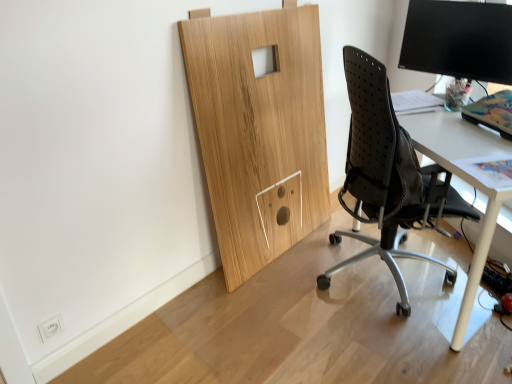
Question: Is white glossy desk at right at the left side of black mesh chair at right?

Choices:
 (A) no
 (B) yes

Answer: (A)

Question: Considering the relative positions of white glossy desk at right and black mesh chair at right in the image provided, is white glossy desk at right in front of black mesh chair at right?

Choices:
 (A) no
 (B) yes

Answer: (A)

Question: Is black mesh chair at right completely or partially inside white glossy desk at right?

Choices:
 (A) no
 (B) yes

Answer: (B)

Question: Are white glossy desk at right and black mesh chair at right far apart?

Choices:
 (A) no
 (B) yes

Answer: (A)

Question: Could you tell me if white glossy desk at right is facing black mesh chair at right?

Choices:
 (A) yes
 (B) no

Answer: (A)

Question: From the image's perspective, is white glossy desk at right over black mesh chair at right?

Choices:
 (A) no
 (B) yes

Answer: (A)

Question: Can you confirm if black mesh chair at right is taller than white glossy desk at right?

Choices:
 (A) yes
 (B) no

Answer: (A)

Question: Is black mesh chair at right aimed at white glossy desk at right?

Choices:
 (A) no
 (B) yes

Answer: (B)

Question: From a real-world perspective, does black mesh chair at right stand above white glossy desk at right?

Choices:
 (A) yes
 (B) no

Answer: (A)

Question: From the image's perspective, is black mesh chair at right located above white glossy desk at right?

Choices:
 (A) no
 (B) yes

Answer: (B)

Question: From a real-world perspective, is black mesh chair at right positioned under white glossy desk at right based on gravity?

Choices:
 (A) yes
 (B) no

Answer: (B)

Question: Can you confirm if black mesh chair at right is bigger than white glossy desk at right?

Choices:
 (A) no
 (B) yes

Answer: (B)

Question: Can you confirm if black mesh chair at right is smaller than black glossy monitor at upper right?

Choices:
 (A) no
 (B) yes

Answer: (A)